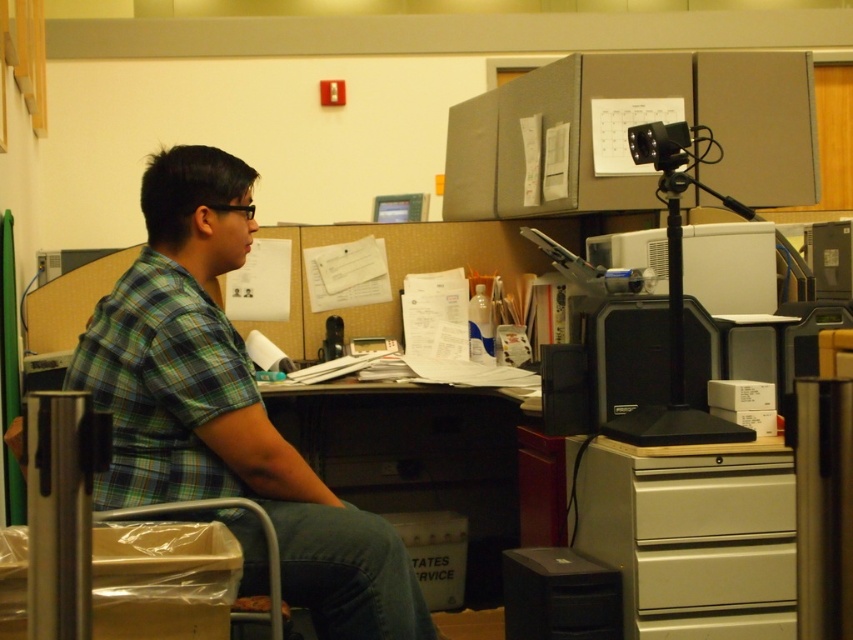
You are organizing a small event and need to place a 2.5 feet wide decorative board on the desk. Given the dark brown wood desk at center and the metallic gray drawer at lower center, which object can accommodate the board without overlapping?

The dark brown wood desk at center has a larger width than the metallic gray drawer at lower center, so the decorative board can be placed on the dark brown wood desk at center without overlapping.

Please provide the exact coordinates of the green plaid shirt at left in the image.

The green plaid shirt at left is located at coordinates point [225,406].